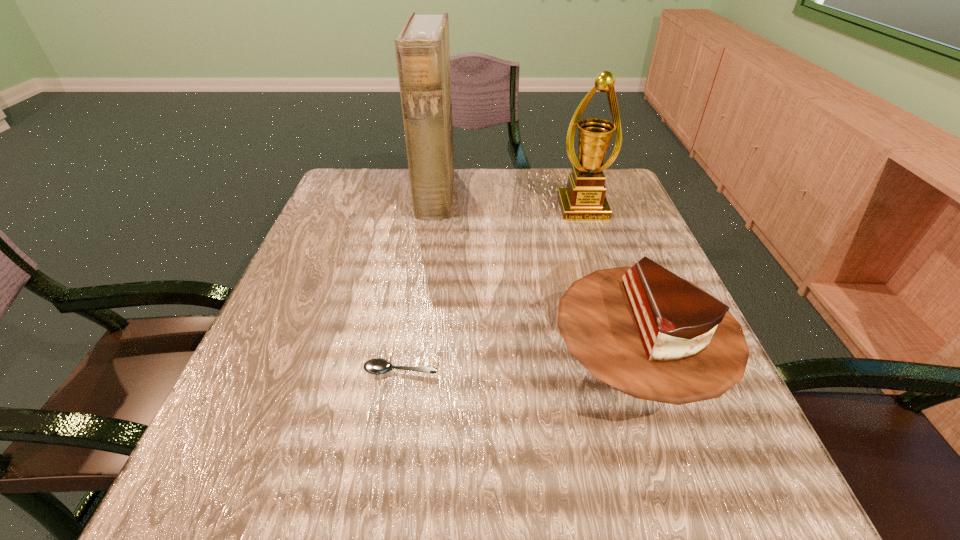
Locate an element on the screen. The image size is (960, 540). vacant area that lies between the shortest object and the cake is located at coordinates (517, 369).

I want to click on blank region between the soupspoon and the third tallest object, so click(x=517, y=369).

At what (x,y) coordinates should I click in order to perform the action: click on vacant point located between the phonebook and the third shortest object. Please return your answer as a coordinate pair (x, y). This screenshot has width=960, height=540. Looking at the image, I should click on (509, 201).

Where is `unoccupied area between the award and the shortest object`? unoccupied area between the award and the shortest object is located at coordinates (492, 289).

At what (x,y) coordinates should I click in order to perform the action: click on empty location between the award and the soupspoon. Please return your answer as a coordinate pair (x, y). The width and height of the screenshot is (960, 540). Looking at the image, I should click on (492, 289).

Where is `vacant space in between the second shortest object and the phonebook`? vacant space in between the second shortest object and the phonebook is located at coordinates (535, 281).

Locate an element on the screen. vacant space that's between the second tallest object and the phonebook is located at coordinates (509, 201).

The image size is (960, 540). Identify the location of free space between the third shortest object and the tallest object. (509, 201).

What are the coordinates of `blank region between the tallest object and the soupspoon` in the screenshot? It's located at (419, 282).

Locate an element on the screen. This screenshot has height=540, width=960. unoccupied position between the phonebook and the shortest object is located at coordinates (419, 282).